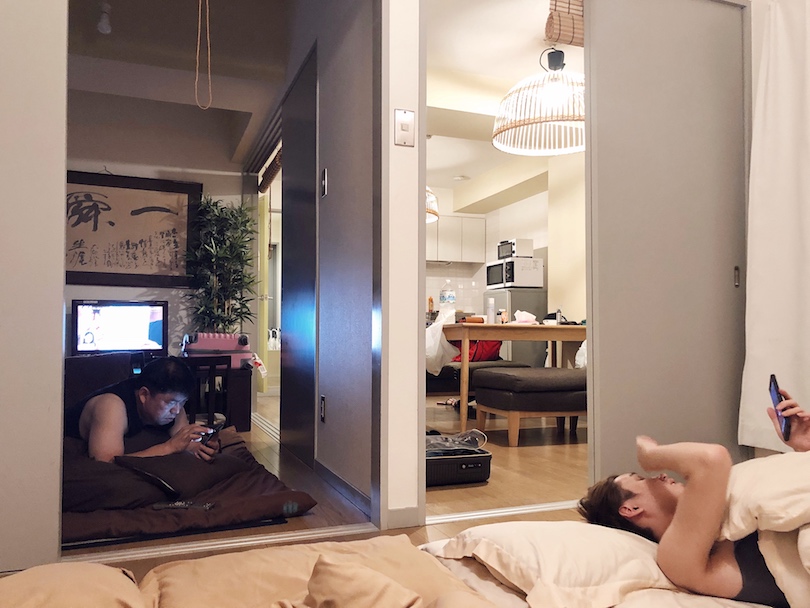
What are the coordinates of `plant` in the screenshot? It's located at (220, 297).